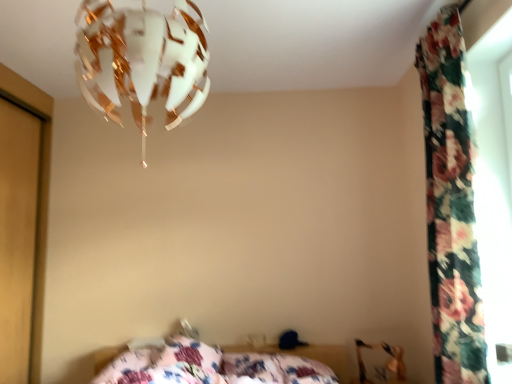
The width and height of the screenshot is (512, 384). Identify the location of floral fabric pillow at lower center, marked as the 2th pillow in a right-to-left arrangement. (189, 354).

This screenshot has width=512, height=384. What do you see at coordinates (141, 61) in the screenshot?
I see `white matte lampshade at upper center` at bounding box center [141, 61].

Image resolution: width=512 pixels, height=384 pixels. What are the coordinates of `floral fabric pillow at lower center, marked as the 1th pillow in a right-to-left arrangement` in the screenshot? It's located at (276, 369).

Measure the distance between metallic gold swivel chair at lower right and camera.

The depth of metallic gold swivel chair at lower right is 8.46 feet.

Identify the location of metallic gold swivel chair at lower right. (384, 364).

Describe the element at coordinates (451, 206) in the screenshot. I see `floral fabric curtain at right` at that location.

This screenshot has width=512, height=384. Find the location of `floral fabric pillow at lower center, which appears as the first pillow when viewed from the left`. floral fabric pillow at lower center, which appears as the first pillow when viewed from the left is located at coordinates click(x=189, y=354).

Would you say metallic gold swivel chair at lower right is inside or outside floral fabric pillow at lower center, which appears as the first pillow when viewed from the left?

metallic gold swivel chair at lower right lies outside floral fabric pillow at lower center, which appears as the first pillow when viewed from the left.

Relative to floral fabric pillow at lower center, marked as the 2th pillow in a right-to-left arrangement, is metallic gold swivel chair at lower right in front or behind?

metallic gold swivel chair at lower right is behind floral fabric pillow at lower center, marked as the 2th pillow in a right-to-left arrangement.

Identify the location of pillow that is the 2nd object to the left of the metallic gold swivel chair at lower right, starting at the anchor. (189, 354).

Which point is more forward, [378,347] or [191,362]?

The point [191,362] is closer.

Which of these two, floral fabric pillow at lower center, marked as the 1th pillow in a right-to-left arrangement, or floral fabric pillow at lower center, which appears as the first pillow when viewed from the left, is wider?

With larger width is floral fabric pillow at lower center, marked as the 1th pillow in a right-to-left arrangement.

Is floral fabric pillow at lower center, marked as the 2th pillow in a right-to-left arrangement, inside floral fabric pillow at lower center, marked as the 1th pillow in a right-to-left arrangement?

Definitely not — floral fabric pillow at lower center, marked as the 2th pillow in a right-to-left arrangement, is not inside floral fabric pillow at lower center, marked as the 1th pillow in a right-to-left arrangement.

Is floral fabric pillow at lower center, marked as the 1th pillow in a right-to-left arrangement, positioned with its back to floral fabric pillow at lower center, marked as the 2th pillow in a right-to-left arrangement?

floral fabric pillow at lower center, marked as the 1th pillow in a right-to-left arrangement, is not turned away from floral fabric pillow at lower center, marked as the 2th pillow in a right-to-left arrangement.

Considering the positions of points (396, 358) and (163, 61), is point (396, 358) closer to camera compared to point (163, 61)?

No.

Who is bigger, metallic gold swivel chair at lower right or white matte lampshade at upper center?

white matte lampshade at upper center is bigger.

Can you confirm if metallic gold swivel chair at lower right is thinner than white matte lampshade at upper center?

Yes.

From the image's perspective, is metallic gold swivel chair at lower right located above or below white matte lampshade at upper center?

Based on their image positions, metallic gold swivel chair at lower right is located beneath white matte lampshade at upper center.

Is white matte lampshade at upper center aimed at floral fabric curtain at right?

No.

From a real-world perspective, is white matte lampshade at upper center located beneath floral fabric curtain at right?

No, from a real-world perspective, white matte lampshade at upper center is not under floral fabric curtain at right.

Does metallic gold swivel chair at lower right have a smaller size compared to floral fabric curtain at right?

Correct, metallic gold swivel chair at lower right occupies less space than floral fabric curtain at right.

Is metallic gold swivel chair at lower right inside or outside of floral fabric curtain at right?

metallic gold swivel chair at lower right is spatially situated outside floral fabric curtain at right.

In the image, there is a floral fabric curtain at right. In order to click on swivel chair below it (from a real-world perspective) in this screenshot , I will do `click(384, 364)`.

Does metallic gold swivel chair at lower right have a greater height compared to floral fabric curtain at right?

No.

Considering the relative positions of floral fabric curtain at right and floral fabric pillow at lower center, the 2th pillow from the left, in the image provided, is floral fabric curtain at right to the left or to the right of floral fabric pillow at lower center, the 2th pillow from the left,?

floral fabric curtain at right is to the right of floral fabric pillow at lower center, the 2th pillow from the left.

In the scene shown: From a real-world perspective, is floral fabric curtain at right located higher than floral fabric pillow at lower center, marked as the 1th pillow in a right-to-left arrangement?

Yes, from a real-world perspective, floral fabric curtain at right is above floral fabric pillow at lower center, marked as the 1th pillow in a right-to-left arrangement.

Can we say floral fabric curtain at right lies outside floral fabric pillow at lower center, the 2th pillow from the left?

That's correct, floral fabric curtain at right is outside of floral fabric pillow at lower center, the 2th pillow from the left.

Does point (436, 187) appear closer or farther from the camera than point (320, 380)?

Clearly, point (436, 187) is closer to the camera than point (320, 380).

What's the angular difference between floral fabric curtain at right and white matte lampshade at upper center's facing directions?

They differ by 89.2 degrees in their facing directions.

From a real-world perspective, which object stands above the other?

From a 3D spatial view, white matte lampshade at upper center is above.

Which object is closer to the camera, floral fabric curtain at right or white matte lampshade at upper center?

Positioned in front is white matte lampshade at upper center.

From the image's perspective, count 2nd pillows upward from the metallic gold swivel chair at lower right and point to it. Please provide its 2D coordinates.

[(189, 354)]

You are a GUI agent. You are given a task and a screenshot of the screen. Output one action in this format:
    pyautogui.click(x=<x>, y=<y>)
    Task: Click on the pillow on the left of floral fabric pillow at lower center, the 2th pillow from the left
    
    Given the screenshot: What is the action you would take?
    pyautogui.click(x=189, y=354)

Looking at the image, which one is located further to floral fabric pillow at lower center, which appears as the first pillow when viewed from the left, floral fabric pillow at lower center, the 2th pillow from the left, or metallic gold swivel chair at lower right?

metallic gold swivel chair at lower right.

Looking at the image, which one is located further to floral fabric curtain at right, metallic gold swivel chair at lower right or floral fabric pillow at lower center, which appears as the first pillow when viewed from the left?

Based on the image, floral fabric pillow at lower center, which appears as the first pillow when viewed from the left, appears to be further to floral fabric curtain at right.

In the scene shown: Estimate the real-world distances between objects in this image. Which object is further from floral fabric pillow at lower center, marked as the 1th pillow in a right-to-left arrangement, white matte lampshade at upper center or floral fabric pillow at lower center, marked as the 2th pillow in a right-to-left arrangement?

white matte lampshade at upper center lies further to floral fabric pillow at lower center, marked as the 1th pillow in a right-to-left arrangement, than the other object.

From the image, which object appears to be nearer to white matte lampshade at upper center, floral fabric curtain at right or floral fabric pillow at lower center, marked as the 2th pillow in a right-to-left arrangement?

floral fabric curtain at right lies closer to white matte lampshade at upper center than the other object.

Estimate the real-world distances between objects in this image. Which object is further from metallic gold swivel chair at lower right, floral fabric pillow at lower center, marked as the 2th pillow in a right-to-left arrangement, or floral fabric curtain at right?

floral fabric curtain at right is positioned further to the anchor metallic gold swivel chair at lower right.

From the image, which object appears to be nearer to floral fabric curtain at right, floral fabric pillow at lower center, marked as the 2th pillow in a right-to-left arrangement, or metallic gold swivel chair at lower right?

metallic gold swivel chair at lower right is closer to floral fabric curtain at right.

Looking at the image, which one is located further to floral fabric curtain at right, metallic gold swivel chair at lower right or floral fabric pillow at lower center, marked as the 1th pillow in a right-to-left arrangement?

Among the two, floral fabric pillow at lower center, marked as the 1th pillow in a right-to-left arrangement, is located further to floral fabric curtain at right.

From the image, which object appears to be nearer to floral fabric pillow at lower center, marked as the 1th pillow in a right-to-left arrangement, floral fabric pillow at lower center, marked as the 2th pillow in a right-to-left arrangement, or white matte lampshade at upper center?

floral fabric pillow at lower center, marked as the 2th pillow in a right-to-left arrangement.

The height and width of the screenshot is (384, 512). I want to click on pillow situated between floral fabric pillow at lower center, which appears as the first pillow when viewed from the left, and floral fabric curtain at right from left to right, so (276, 369).

The image size is (512, 384). I want to click on curtain that lies between white matte lampshade at upper center and metallic gold swivel chair at lower right from top to bottom, so click(451, 206).

Where is `curtain between white matte lampshade at upper center and floral fabric pillow at lower center, the 2th pillow from the left, vertically`? The width and height of the screenshot is (512, 384). curtain between white matte lampshade at upper center and floral fabric pillow at lower center, the 2th pillow from the left, vertically is located at coordinates (451, 206).

Locate an element on the screen. This screenshot has height=384, width=512. swivel chair between floral fabric pillow at lower center, marked as the 2th pillow in a right-to-left arrangement, and floral fabric curtain at right, in the horizontal direction is located at coordinates (384, 364).